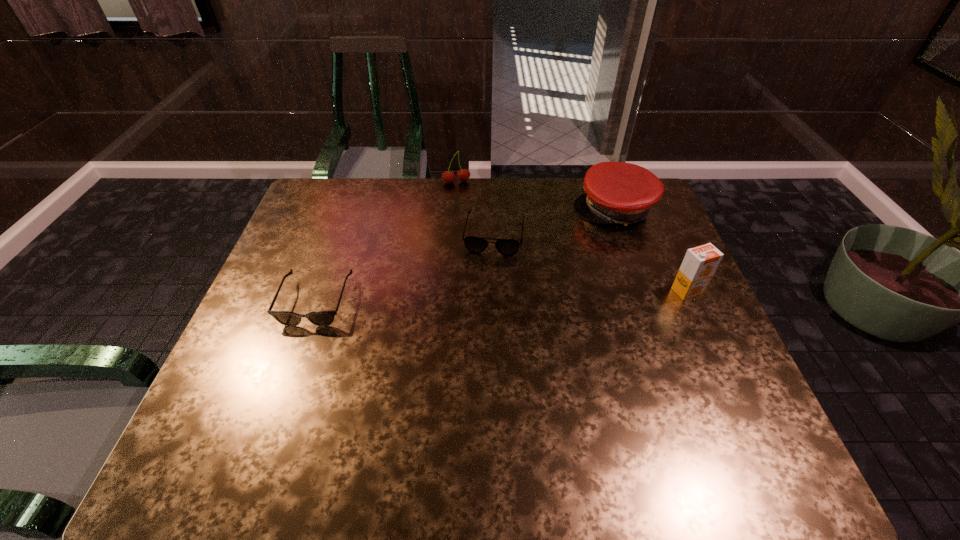
Locate an element on the screen. free space on the desktop that is between the leftmost object and the orange juice and is positioned on the surface of the cherry is located at coordinates (480, 296).

You are a GUI agent. You are given a task and a screenshot of the screen. Output one action in this format:
    pyautogui.click(x=<x>, y=<y>)
    Task: Click on the free spot on the desktop that is between the sunglasses and the tallest object and is positioned on the front-facing side of the spectacles
    The image size is (960, 540).
    Given the screenshot: What is the action you would take?
    pyautogui.click(x=485, y=296)

I want to click on vacant space on the desktop that is between the leftmost object and the tallest object and is positioned at the front of the cap where the visor is located, so click(488, 296).